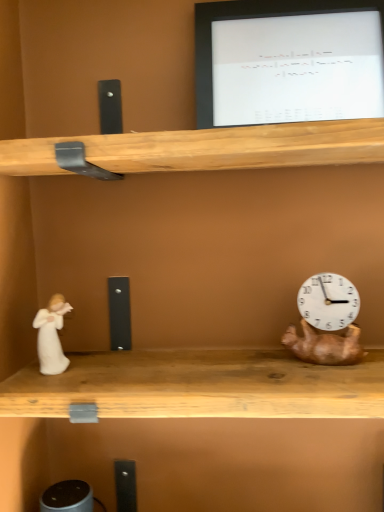
Question: Should I look upward or downward to see white porcelain figurine at left?

Choices:
 (A) down
 (B) up

Answer: (A)

Question: Is copper metallic clock at right closer to the viewer compared to white glossy monitor at upper center?

Choices:
 (A) yes
 (B) no

Answer: (A)

Question: Is copper metallic clock at right in contact with white glossy monitor at upper center?

Choices:
 (A) no
 (B) yes

Answer: (A)

Question: Is copper metallic clock at right further to the viewer compared to white glossy monitor at upper center?

Choices:
 (A) no
 (B) yes

Answer: (A)

Question: Is copper metallic clock at right smaller than white glossy monitor at upper center?

Choices:
 (A) no
 (B) yes

Answer: (B)

Question: Is copper metallic clock at right outside of white glossy monitor at upper center?

Choices:
 (A) no
 (B) yes

Answer: (B)

Question: From the image's perspective, is copper metallic clock at right on top of white glossy monitor at upper center?

Choices:
 (A) yes
 (B) no

Answer: (B)

Question: Does copper metallic clock at right have a greater width compared to white porcelain figurine at left?

Choices:
 (A) yes
 (B) no

Answer: (A)

Question: Is copper metallic clock at right aimed at white porcelain figurine at left?

Choices:
 (A) yes
 (B) no

Answer: (B)

Question: Can you confirm if copper metallic clock at right is thinner than white porcelain figurine at left?

Choices:
 (A) no
 (B) yes

Answer: (A)

Question: From the image's perspective, would you say copper metallic clock at right is shown under white porcelain figurine at left?

Choices:
 (A) no
 (B) yes

Answer: (A)

Question: Is copper metallic clock at right bigger than white porcelain figurine at left?

Choices:
 (A) no
 (B) yes

Answer: (B)

Question: From the image's perspective, is copper metallic clock at right above white porcelain figurine at left?

Choices:
 (A) no
 (B) yes

Answer: (B)

Question: From the image's perspective, is white porcelain figurine at left located beneath white glossy monitor at upper center?

Choices:
 (A) no
 (B) yes

Answer: (B)